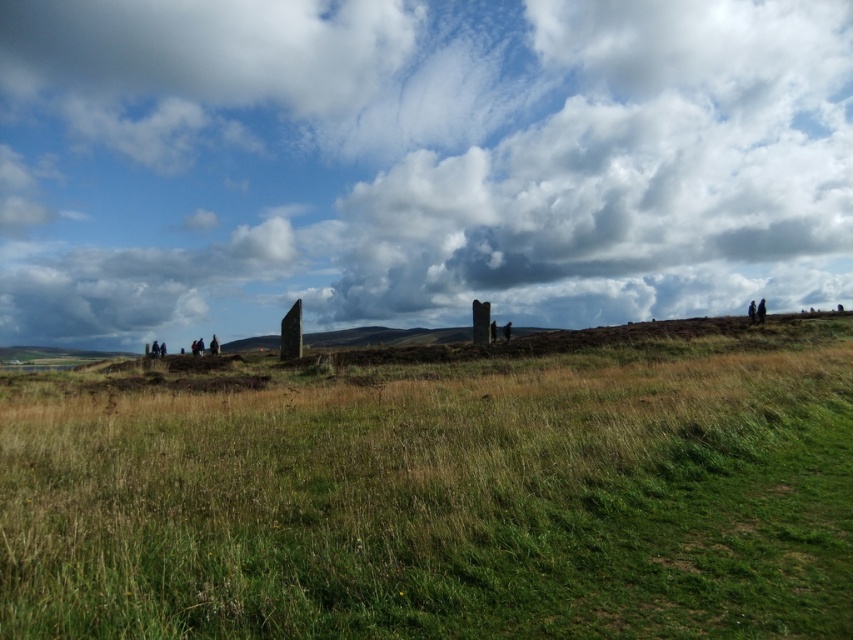
Question: Does cloudy sky at upper center have a smaller size compared to green grassy field at center?

Choices:
 (A) no
 (B) yes

Answer: (A)

Question: Can you confirm if cloudy sky at upper center is smaller than green grassy field at center?

Choices:
 (A) yes
 (B) no

Answer: (B)

Question: Is cloudy sky at upper center wider than green grassy field at center?

Choices:
 (A) yes
 (B) no

Answer: (A)

Question: Which object appears farthest from the camera in this image?

Choices:
 (A) cloudy sky at upper center
 (B) green grassy field at center

Answer: (A)

Question: Among these points, which one is farthest from the camera?

Choices:
 (A) (245, 99)
 (B) (804, 342)

Answer: (A)